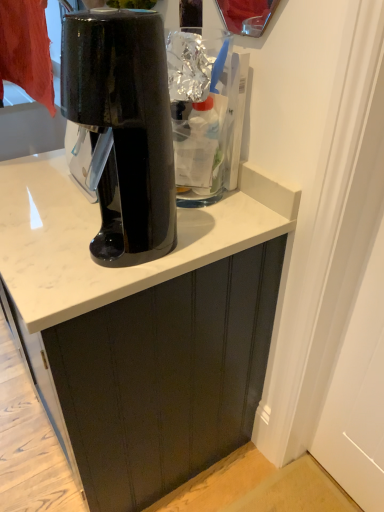
Question: From the image's perspective, does glossy black coffee maker at center appear higher than matte black cabinet at center?

Choices:
 (A) yes
 (B) no

Answer: (A)

Question: Is glossy black coffee maker at center positioned behind matte black cabinet at center?

Choices:
 (A) yes
 (B) no

Answer: (B)

Question: Does glossy black coffee maker at center have a greater width compared to matte black cabinet at center?

Choices:
 (A) no
 (B) yes

Answer: (A)

Question: Is glossy black coffee maker at center facing away from matte black cabinet at center?

Choices:
 (A) no
 (B) yes

Answer: (A)

Question: Is glossy black coffee maker at center completely or partially outside of matte black cabinet at center?

Choices:
 (A) yes
 (B) no

Answer: (A)

Question: Is glossy black coffee maker at center thinner than matte black cabinet at center?

Choices:
 (A) no
 (B) yes

Answer: (B)

Question: Can you confirm if matte black cabinet at center is thinner than glossy black coffee maker at center?

Choices:
 (A) no
 (B) yes

Answer: (A)

Question: Considering the relative sizes of matte black cabinet at center and glossy black coffee maker at center in the image provided, is matte black cabinet at center taller than glossy black coffee maker at center?

Choices:
 (A) yes
 (B) no

Answer: (B)

Question: From the image's perspective, does matte black cabinet at center appear lower than glossy black coffee maker at center?

Choices:
 (A) no
 (B) yes

Answer: (B)

Question: Could you tell me if matte black cabinet at center is facing glossy black coffee maker at center?

Choices:
 (A) no
 (B) yes

Answer: (A)

Question: Is matte black cabinet at center in front of glossy black coffee maker at center?

Choices:
 (A) yes
 (B) no

Answer: (B)

Question: Does matte black cabinet at center have a lesser height compared to glossy black coffee maker at center?

Choices:
 (A) no
 (B) yes

Answer: (B)

Question: Looking at their shapes, would you say glossy black coffee maker at center is wider or thinner than matte black cabinet at center?

Choices:
 (A) wide
 (B) thin

Answer: (B)